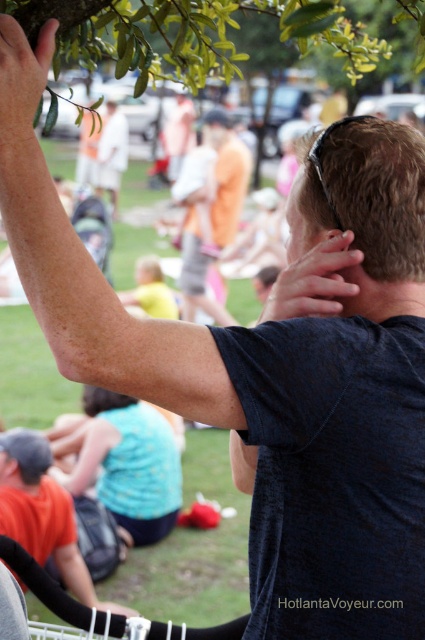
Based on the scene description, if you were standing where the person in the dark blue tshirt is, which object would be higher in your field of view, the green leafy branch at upper center or the green matte leaf at upper left?

The green leafy branch at upper center is located above the green matte leaf at upper left, so it would be higher in your field of view.

You are a photographer trying to capture a candid shot of the orange cotton shorts at center and the matte black hand at upper center. Which object should you focus on first to ensure it appears sharp in your photo?

You should focus on the orange cotton shorts at center first because it is closer to the viewer than the matte black hand at upper center, ensuring it remains sharp while the hand may appear slightly blurred if not focused properly.